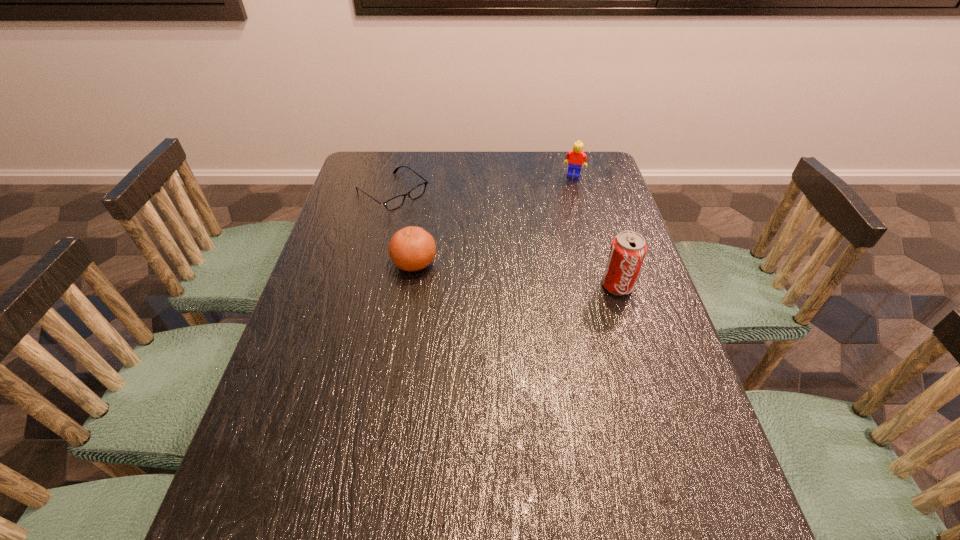
In the image, there is a desktop. What are the coordinates of `vacant area at the left edge` in the screenshot? It's located at (394, 191).

In the image, there is a desktop. Where is `free region at the right edge`? free region at the right edge is located at coordinates (577, 209).

Locate an element on the screen. This screenshot has width=960, height=540. free space at the far left corner is located at coordinates (357, 165).

At what (x,y) coordinates should I click in order to perform the action: click on free space between the soda can and the clementine. Please return your answer as a coordinate pair (x, y). Looking at the image, I should click on (516, 274).

I want to click on free space that is in between the tallest object and the Lego, so click(x=595, y=231).

Find the location of a particular element. This screenshot has height=540, width=960. empty space that is in between the shortest object and the clementine is located at coordinates (403, 228).

This screenshot has height=540, width=960. I want to click on free spot between the third tallest object and the Lego, so click(x=493, y=219).

At what (x,y) coordinates should I click in order to perform the action: click on free point between the clementine and the Lego. Please return your answer as a coordinate pair (x, y). Looking at the image, I should click on (493, 219).

The image size is (960, 540). Find the location of `vacant area that lies between the second tallest object and the spectacles`. vacant area that lies between the second tallest object and the spectacles is located at coordinates (483, 184).

At what (x,y) coordinates should I click in order to perform the action: click on free space between the third tallest object and the soda can. Please return your answer as a coordinate pair (x, y). Looking at the image, I should click on (516, 274).